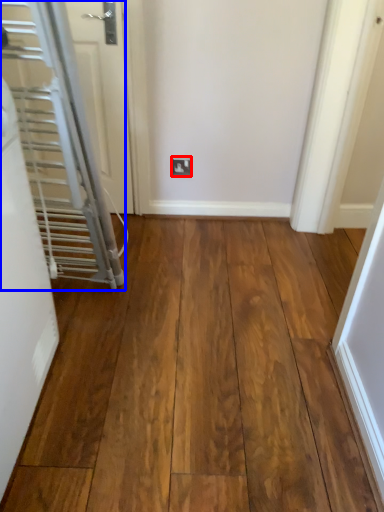
Question: Which object is closer to the camera taking this photo, electric outlet (highlighted by a red box) or door (highlighted by a blue box)?

Choices:
 (A) electric outlet
 (B) door

Answer: (B)